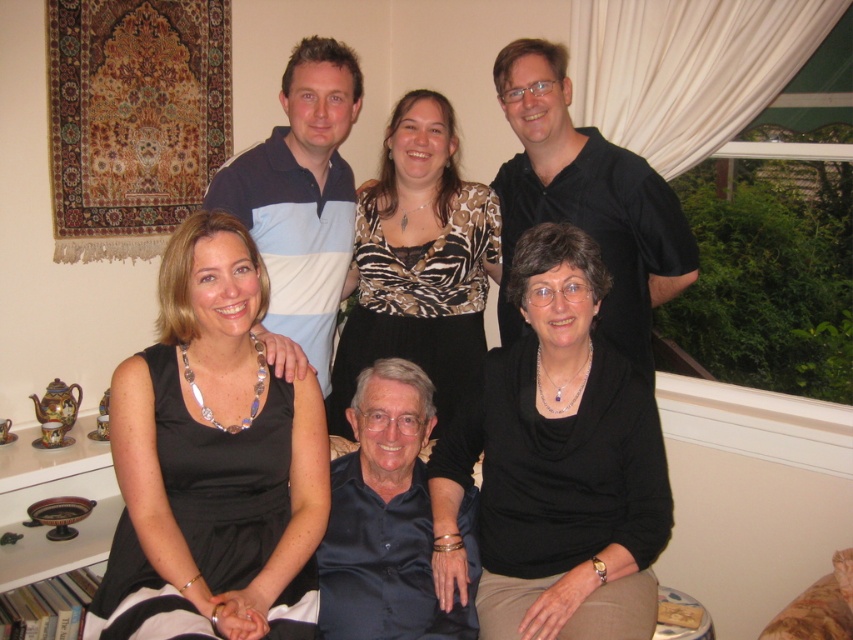
You are a photographer trying to adjust the lighting for a group photo. You notice two black items in the image. The black matte sweater at lower center and the black silk dress at upper center. Which one is positioned to the right of the other?

The black matte sweater at lower center is to the right of the black silk dress at upper center.

You are a photographer setting up for a group photo in the living room. You need to ensure that the black matte sweater at lower center and the zebra print blouse at center are both visible in the frame. Based on their positions, which clothing item should you adjust to keep both in the shot?

The black matte sweater at lower center is to the right of the zebra print blouse at center. To keep both in the frame, you should adjust the zebra print blouse at center slightly to the left to make space for the black matte sweater at lower center.